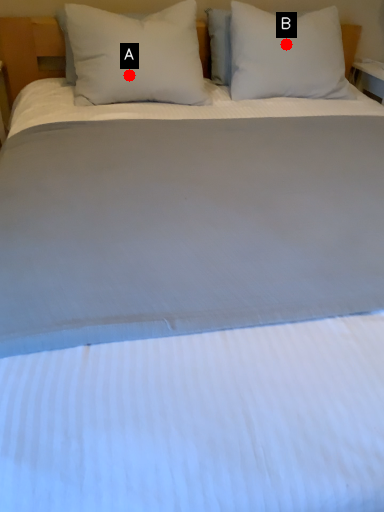
Question: Two points are circled on the image, labeled by A and B beside each circle. Among these points, which one is nearest to the camera?

Choices:
 (A) A is closer
 (B) B is closer

Answer: (A)